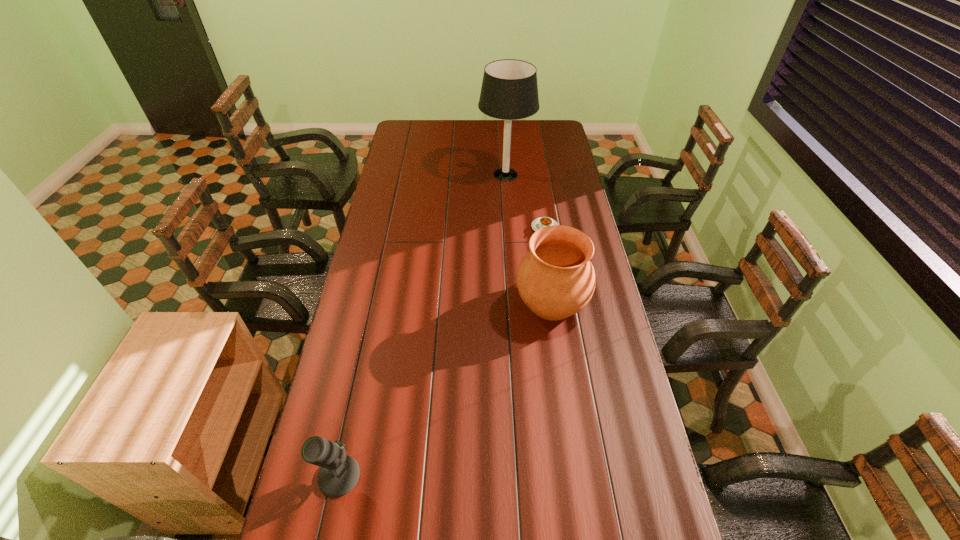
Identify the location of vacant space located on the back of the leftmost object. (350, 423).

Where is `vacant space located on the back of the shortest object`? The image size is (960, 540). vacant space located on the back of the shortest object is located at coordinates (541, 206).

I want to click on object present at the left edge, so click(339, 474).

Find the location of `pottery that is at the right edge`. pottery that is at the right edge is located at coordinates (555, 279).

Where is `pudding present at the right edge`? pudding present at the right edge is located at coordinates (541, 222).

Locate an element on the screen. The height and width of the screenshot is (540, 960). free space at the far edge is located at coordinates (524, 136).

Locate an element on the screen. The image size is (960, 540). vacant space at the left edge of the desktop is located at coordinates (343, 500).

This screenshot has width=960, height=540. In the image, there is a desktop. Identify the location of vacant space at the right edge. (662, 539).

The width and height of the screenshot is (960, 540). In the image, there is a desktop. In order to click on vacant area at the far right corner in this screenshot , I will do `click(538, 124)`.

Where is `vacant space that is in between the pottery and the table lamp`? Image resolution: width=960 pixels, height=540 pixels. vacant space that is in between the pottery and the table lamp is located at coordinates (529, 238).